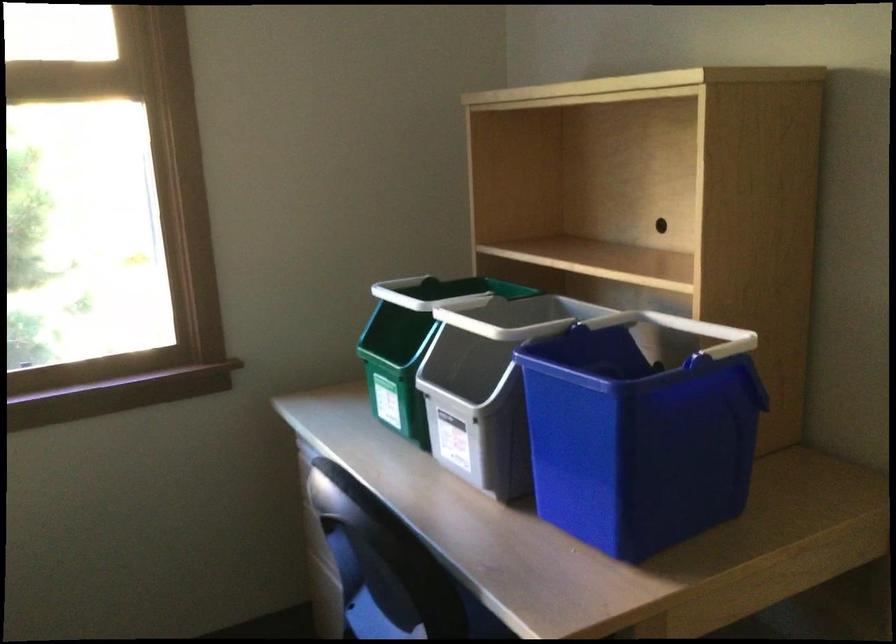
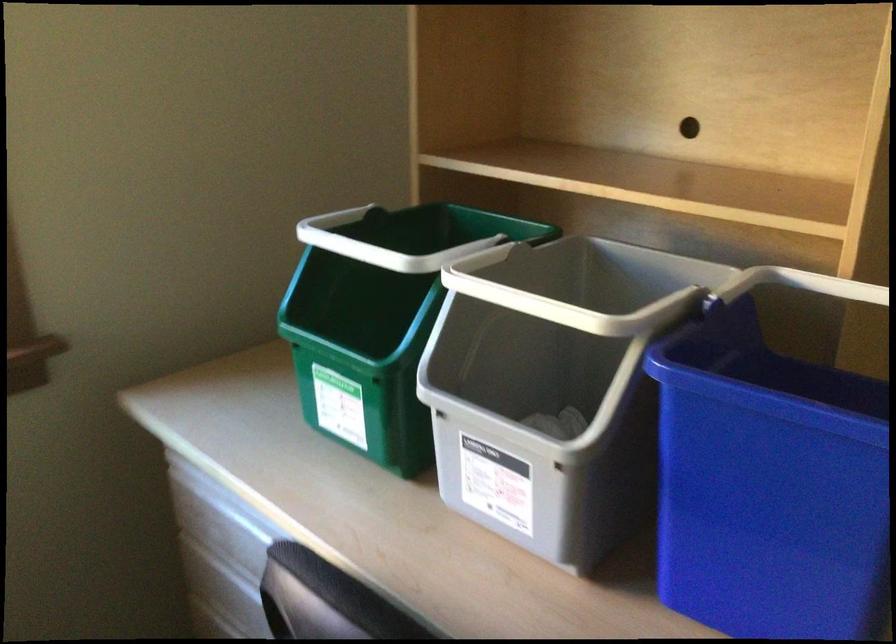
Which direction would the cameraman need to move to produce the second image?

The cameraman walked toward left, forward.